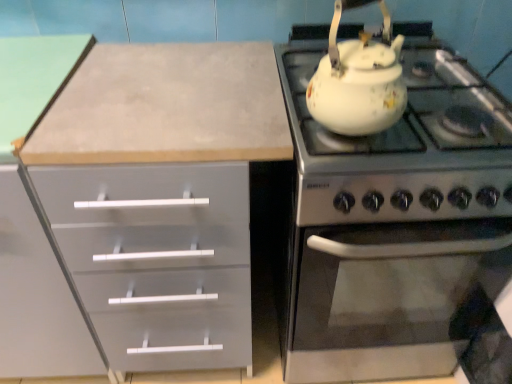
What do you see at coordinates (394, 219) in the screenshot? I see `white glossy kettle at upper right` at bounding box center [394, 219].

Where is `white glossy kettle at upper right`? white glossy kettle at upper right is located at coordinates (394, 219).

In the scene shown: What is the approximate width of white glossy kettle at upper right?

white glossy kettle at upper right is 26.42 inches wide.

This screenshot has width=512, height=384. Describe the element at coordinates (358, 80) in the screenshot. I see `white glossy teapot at upper right` at that location.

Image resolution: width=512 pixels, height=384 pixels. In order to click on white glossy teapot at upper right in this screenshot , I will do `click(358, 80)`.

Image resolution: width=512 pixels, height=384 pixels. Find the location of `white glossy kettle at upper right`. white glossy kettle at upper right is located at coordinates (394, 219).

Between white glossy kettle at upper right and white glossy teapot at upper right, which one appears on the right side from the viewer's perspective?

Positioned to the right is white glossy kettle at upper right.

Which is in front, white glossy kettle at upper right or white glossy teapot at upper right?

white glossy teapot at upper right is in front.

Is point (420, 206) farther from viewer compared to point (333, 56)?

That is True.

From the image's perspective, is white glossy kettle at upper right above white glossy teapot at upper right?

No, from the image's perspective, white glossy kettle at upper right is not on top of white glossy teapot at upper right.

From a real-world perspective, who is located lower, white glossy kettle at upper right or white glossy teapot at upper right?

white glossy kettle at upper right is physically lower.

Between white glossy kettle at upper right and white glossy teapot at upper right, which one has larger width?

With larger width is white glossy kettle at upper right.

Considering the sizes of objects white glossy kettle at upper right and white glossy teapot at upper right in the image provided, who is taller, white glossy kettle at upper right or white glossy teapot at upper right?

white glossy kettle at upper right.

Looking at this image, considering the relative sizes of white glossy kettle at upper right and white glossy teapot at upper right in the image provided, is white glossy kettle at upper right bigger than white glossy teapot at upper right?

Yes, white glossy kettle at upper right is bigger than white glossy teapot at upper right.

Is white glossy kettle at upper right not inside white glossy teapot at upper right?

white glossy kettle at upper right lies outside white glossy teapot at upper right's area.

Is white glossy kettle at upper right not near white glossy teapot at upper right?

No, white glossy kettle at upper right is not far from white glossy teapot at upper right.

Is white glossy kettle at upper right positioned with its back to white glossy teapot at upper right?

No, white glossy kettle at upper right is not facing away from white glossy teapot at upper right.

Identify the location of kettle that is above the white glossy kettle at upper right (from a real-world perspective). (358, 80).

Considering the positions of objects white glossy teapot at upper right and white glossy kettle at upper right in the image provided, who is more to the left, white glossy teapot at upper right or white glossy kettle at upper right?

From the viewer's perspective, white glossy teapot at upper right appears more on the left side.

Which object is further away from the camera, white glossy teapot at upper right or white glossy kettle at upper right?

white glossy kettle at upper right is further away from the camera.

Which point is more distant from viewer, (324, 120) or (449, 123)?

The point (449, 123) is behind.

From the image's perspective, would you say white glossy teapot at upper right is positioned over white glossy kettle at upper right?

Yes, from the image's perspective, white glossy teapot at upper right is above white glossy kettle at upper right.

From a real-world perspective, is white glossy teapot at upper right on top of white glossy kettle at upper right?

Yes.

Can you confirm if white glossy teapot at upper right is thinner than white glossy kettle at upper right?

Correct, the width of white glossy teapot at upper right is less than that of white glossy kettle at upper right.

Does white glossy teapot at upper right have a lesser height compared to white glossy kettle at upper right?

Yes.

Who is smaller, white glossy teapot at upper right or white glossy kettle at upper right?

With smaller size is white glossy teapot at upper right.

Can we say white glossy teapot at upper right lies outside white glossy kettle at upper right?

Yes, white glossy teapot at upper right is located beyond the bounds of white glossy kettle at upper right.

Looking at this image, is white glossy teapot at upper right far away from white glossy kettle at upper right?

No, white glossy teapot at upper right is not far away from white glossy kettle at upper right.

Is white glossy teapot at upper right facing away from white glossy kettle at upper right?

No.

The width and height of the screenshot is (512, 384). In order to click on appliance below the white glossy teapot at upper right (from a real-world perspective) in this screenshot , I will do `click(394, 219)`.

In the image, there is a white glossy teapot at upper right. Identify the location of appliance below it (from a real-world perspective). Image resolution: width=512 pixels, height=384 pixels. (394, 219).

There is a white glossy kettle at upper right. What are the coordinates of `kettle above it (from a real-world perspective)` in the screenshot? It's located at (358, 80).